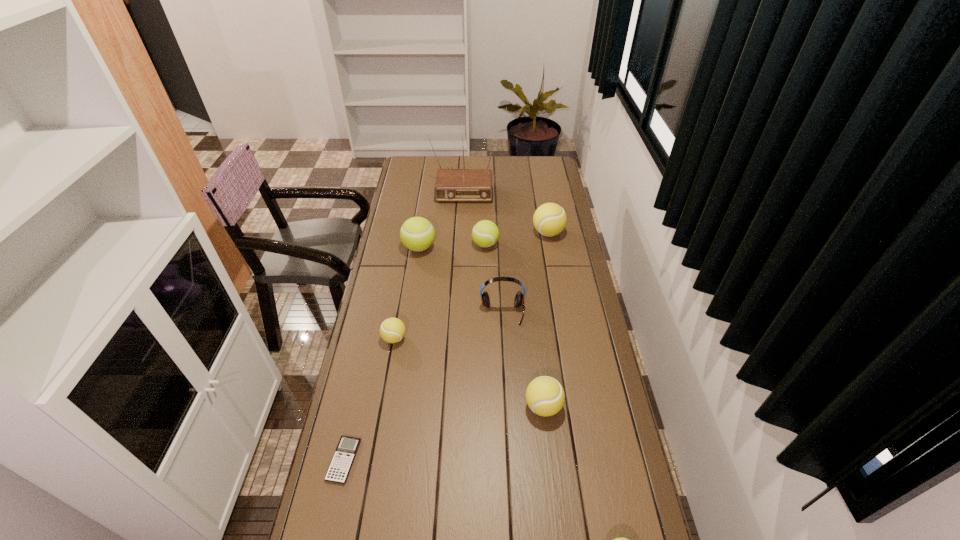
At what (x,y) coordinates should I click in order to perform the action: click on tennis ball that is the closest to the nearest green tennis ball. Please return your answer as a coordinate pair (x, y). The height and width of the screenshot is (540, 960). Looking at the image, I should click on (545, 396).

I want to click on tennis ball that is the second closest to the farthest yellow tennis ball, so click(417, 233).

Locate which yellow tennis ball ranks second in proximity to the farthest object. Please provide its 2D coordinates. Your answer should be formatted as a tuple, i.e. [(x, y)], where the tuple contains the x and y coordinates of a point satisfying the conditions above.

[(392, 330)]

Locate which yellow tennis ball ranks second in proximity to the headset. Please provide its 2D coordinates. Your answer should be formatted as a tuple, i.e. [(x, y)], where the tuple contains the x and y coordinates of a point satisfying the conditions above.

[(545, 396)]

Point out which green tennis ball is positioned as the nearest to the shortest object. Please provide its 2D coordinates. Your answer should be formatted as a tuple, i.e. [(x, y)], where the tuple contains the x and y coordinates of a point satisfying the conditions above.

[(620, 539)]

Point out which green tennis ball is positioned as the third nearest to the red headset. Please provide its 2D coordinates. Your answer should be formatted as a tuple, i.e. [(x, y)], where the tuple contains the x and y coordinates of a point satisfying the conditions above.

[(620, 539)]

Find the location of a particular element. vacant space that satisfies the following two spatial constraints: 1. on the front panel of the third tennis ball from left to right; 2. on the left side of the farthest object is located at coordinates (460, 245).